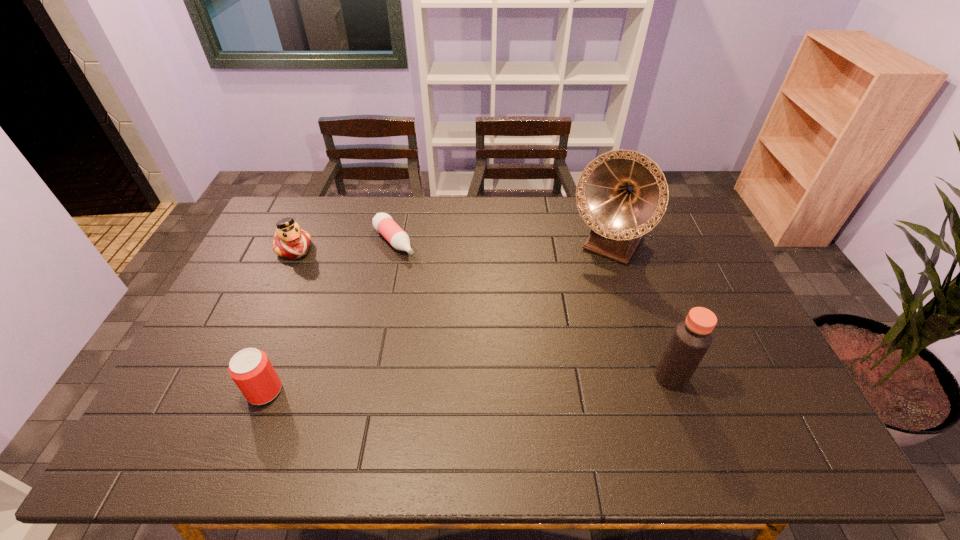
I want to click on beer can, so click(251, 370).

Locate an element on the screen. vinegar is located at coordinates (691, 339).

Image resolution: width=960 pixels, height=540 pixels. I want to click on the tallest object, so pyautogui.click(x=621, y=195).

Image resolution: width=960 pixels, height=540 pixels. What are the coordinates of `duck` in the screenshot? It's located at (290, 241).

I want to click on the third object from left to right, so click(x=383, y=223).

Where is `bottle`? The height and width of the screenshot is (540, 960). bottle is located at coordinates (383, 223).

The width and height of the screenshot is (960, 540). Find the location of `vacant space located 0.070m on the back of the beer can`. vacant space located 0.070m on the back of the beer can is located at coordinates (279, 354).

Find the location of a particular element. free spot located 0.180m on the left of the vinegar is located at coordinates (587, 377).

Where is `vacant space situated 0.080m on the horn of the phonograph record`? vacant space situated 0.080m on the horn of the phonograph record is located at coordinates (583, 283).

Locate an element on the screen. The width and height of the screenshot is (960, 540). free space located 0.400m on the horn of the phonograph record is located at coordinates (538, 354).